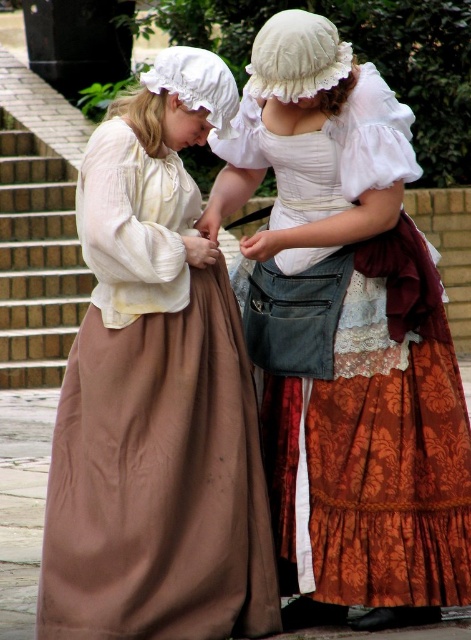
Does point (302, 452) come closer to viewer compared to point (167, 413)?

No, it is behind (167, 413).

Is matte white blouse at center to the left of matte brown skirt at center from the viewer's perspective?

Incorrect, matte white blouse at center is not on the left side of matte brown skirt at center.

Where is `matte white blouse at center`? matte white blouse at center is located at coordinates (347, 336).

Based on the photo, is matte brown skirt at center taller than brick at left?

Indeed, matte brown skirt at center has a greater height compared to brick at left.

Does matte brown skirt at center come in front of brick at left?

Yes, matte brown skirt at center is closer to the viewer.

Locate an element on the screen. Image resolution: width=471 pixels, height=640 pixels. matte brown skirt at center is located at coordinates (x=155, y=394).

Looking at this image, is matte white blouse at center further to camera compared to brick at left?

No.

Is point (417, 240) positioned behind point (6, 118)?

No, (417, 240) is closer to viewer.

What are the coordinates of `matte white blouse at center` in the screenshot? It's located at (347, 336).